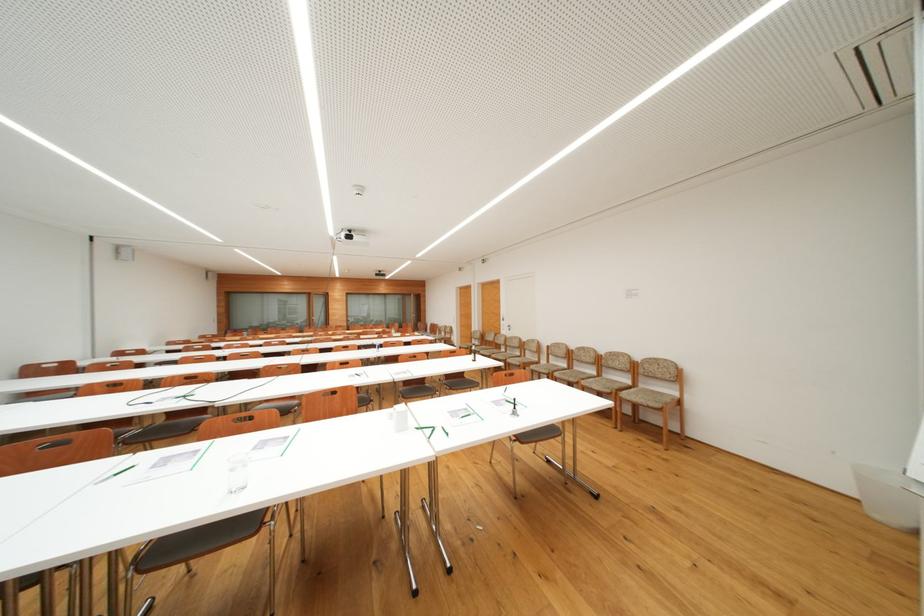
The location [116,472] corresponds to which object?

It refers to a black pen.